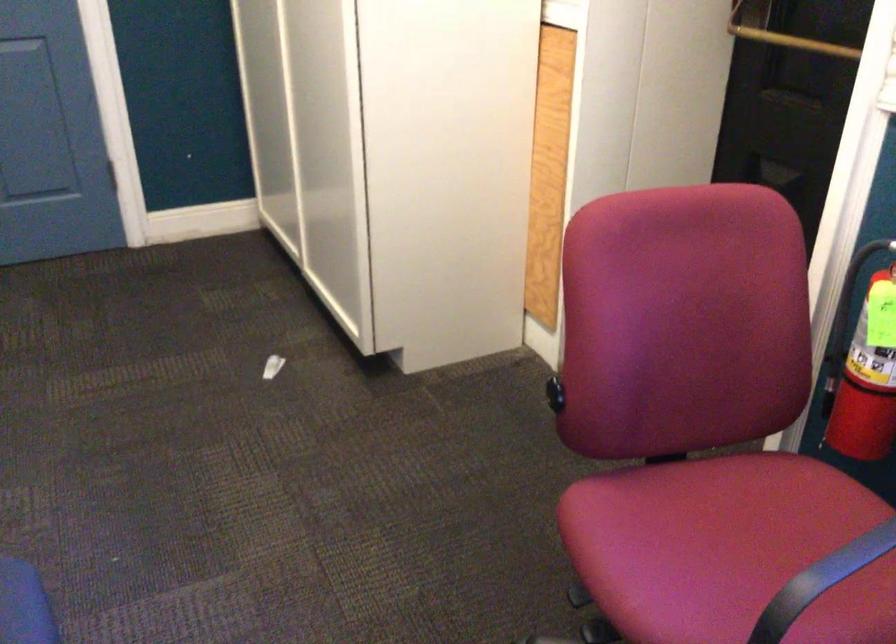
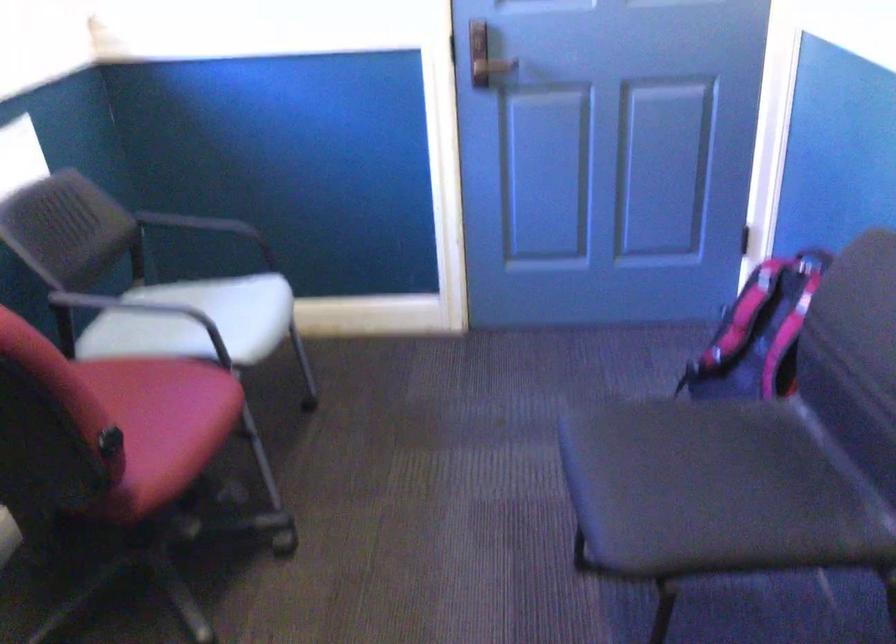
Question: I am providing you with two images of the same scene from different viewpoints. Please identify which objects are invisible in image2.

Choices:
 (A) pink rice cooker handle
 (B) pink and black backpack
 (C) red chair sitting surface
 (D) pink chair sitting surface

Answer: (D)